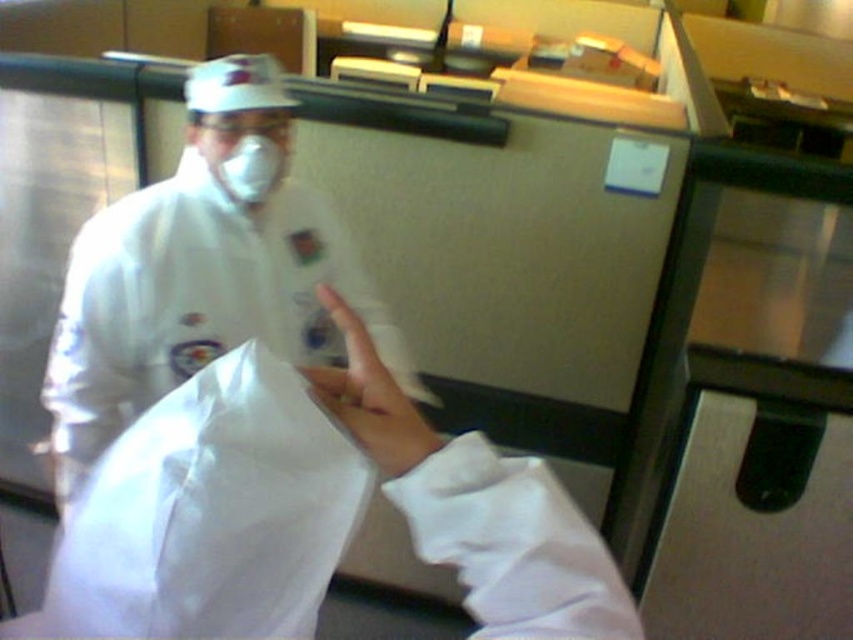
Question: Among these objects, which one is nearest to the camera?

Choices:
 (A) white matte hand at center
 (B) white matte lab coat at center
 (C) matte white mask at center

Answer: (A)

Question: Which point is farther to the camera?

Choices:
 (A) white matte lab coat at center
 (B) white matte hand at center
 (C) matte white mask at center

Answer: (C)

Question: Which point is farther to the camera?

Choices:
 (A) matte white mask at center
 (B) white matte lab coat at center
 (C) white matte hand at center

Answer: (A)

Question: Is white matte hand at center thinner than matte white mask at center?

Choices:
 (A) yes
 (B) no

Answer: (A)

Question: Is white matte lab coat at center to the right of white matte hand at center from the viewer's perspective?

Choices:
 (A) yes
 (B) no

Answer: (B)

Question: Where is white matte hand at center located in relation to matte white mask at center in the image?

Choices:
 (A) above
 (B) below

Answer: (B)